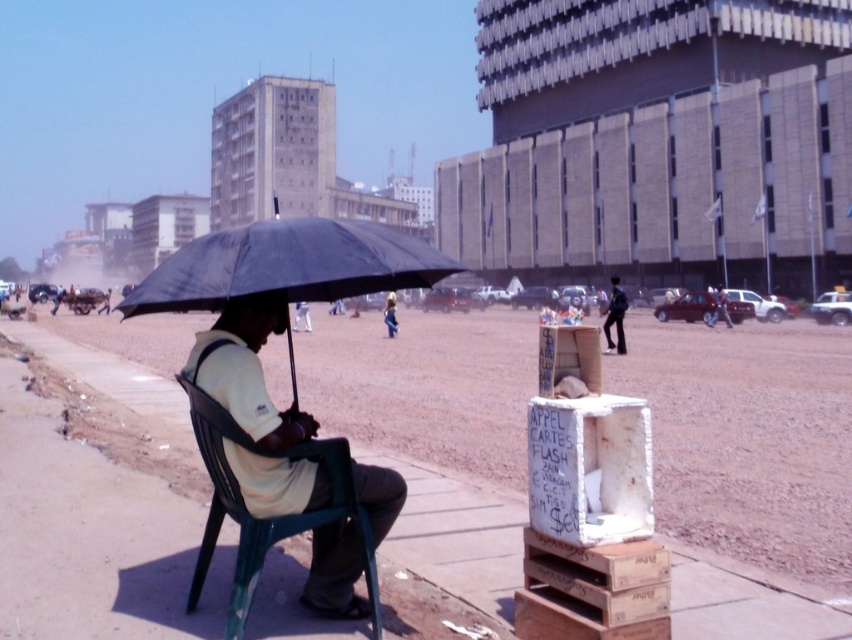
Who is taller, black matte umbrella at center or green plastic chair at center?

black matte umbrella at center

Is point (231, 268) closer to camera compared to point (216, 442)?

Yes, point (231, 268) is in front of point (216, 442).

Which is in front, point (283, 308) or point (220, 484)?

Point (220, 484) is in front.

Where is `black matte umbrella at center`? black matte umbrella at center is located at coordinates (288, 268).

Between black matte umbrella at center and light blue jeans at center, which one has more height?

Standing taller between the two is black matte umbrella at center.

Is point (353, 285) farther from viewer compared to point (389, 304)?

No, it is not.

Locate an element on the screen. The width and height of the screenshot is (852, 640). black matte umbrella at center is located at coordinates (288, 268).

Does dark blue uniform at center appear on the left side of light blue jeans at center?

In fact, dark blue uniform at center is to the right of light blue jeans at center.

Between dark blue uniform at center and light blue jeans at center, which one appears on the right side from the viewer's perspective?

From the viewer's perspective, dark blue uniform at center appears more on the right side.

Is point (616, 298) closer to viewer compared to point (394, 333)?

Yes, point (616, 298) is in front of point (394, 333).

At what (x,y) coordinates should I click in order to perform the action: click on dark blue uniform at center. Please return your answer as a coordinate pair (x, y). The width and height of the screenshot is (852, 640). Looking at the image, I should click on (614, 317).